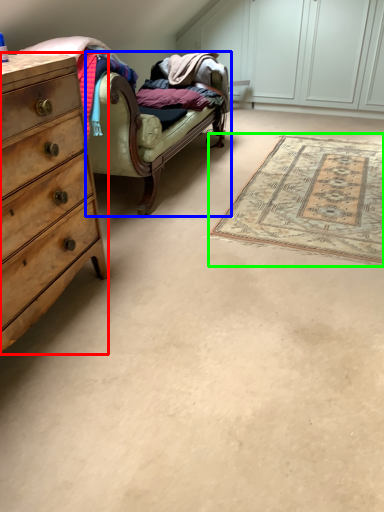
Question: Which is nearer to the chest of drawers (highlighted by a red box)? studio couch (highlighted by a blue box) or mat (highlighted by a green box).

Choices:
 (A) studio couch
 (B) mat

Answer: (A)